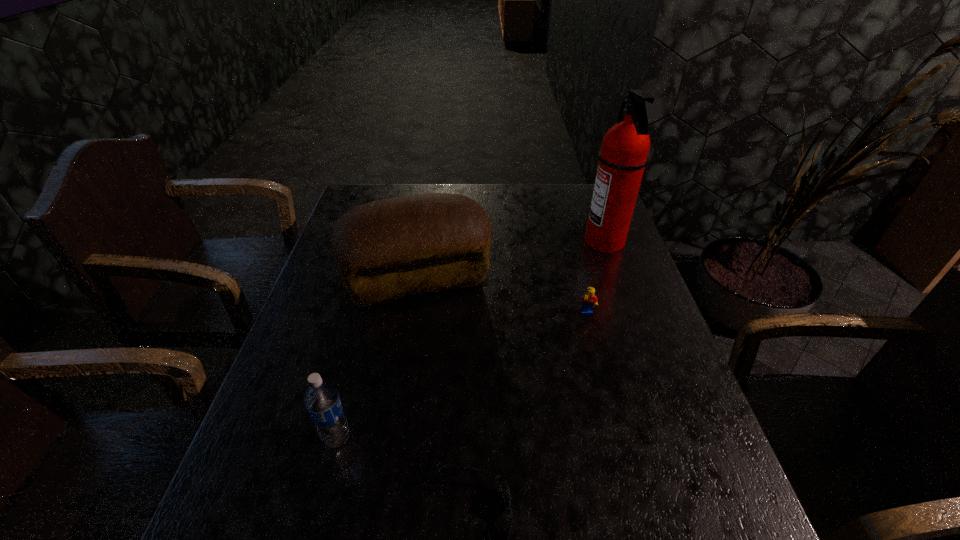
At what (x,y) coordinates should I click in order to perform the action: click on the closest object to the second tallest object. Please return your answer as a coordinate pair (x, y). This screenshot has width=960, height=540. Looking at the image, I should click on (589, 300).

Identify the location of free space that satisfies the following two spatial constraints: 1. on the back side of the second tallest object; 2. on the right side of the fourth farthest object. The image size is (960, 540). (379, 278).